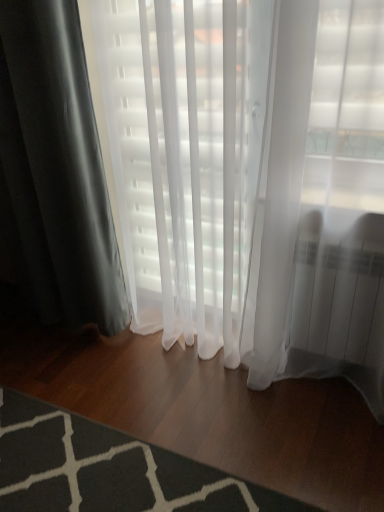
This screenshot has height=512, width=384. I want to click on matte black curtain at left, so click(x=55, y=170).

This screenshot has height=512, width=384. Describe the element at coordinates (55, 170) in the screenshot. I see `matte black curtain at left` at that location.

What is the approximate height of dark gray textured rug at lower left?

1.58 inches.

You are a GUI agent. You are given a task and a screenshot of the screen. Output one action in this format:
    pyautogui.click(x=<x>, y=<y>)
    Task: Click on the dark gray textured rug at lower left
    
    Given the screenshot: What is the action you would take?
    pyautogui.click(x=109, y=469)

This screenshot has width=384, height=512. What do you see at coordinates (109, 469) in the screenshot?
I see `dark gray textured rug at lower left` at bounding box center [109, 469].

The width and height of the screenshot is (384, 512). Find the location of `matte black curtain at left`. matte black curtain at left is located at coordinates (55, 170).

Considering the positions of objects matte black curtain at left and dark gray textured rug at lower left in the image provided, who is more to the right, matte black curtain at left or dark gray textured rug at lower left?

dark gray textured rug at lower left.

Is matte black curtain at left in front of dark gray textured rug at lower left?

No, it is not.

Considering the points (75, 52) and (66, 420), which point is behind, point (75, 52) or point (66, 420)?

The point (66, 420) is behind.

Consider the image. From the image's perspective, is matte black curtain at left under dark gray textured rug at lower left?

No.

From a real-world perspective, is matte black curtain at left below dark gray textured rug at lower left?

No, from a real-world perspective, matte black curtain at left is not beneath dark gray textured rug at lower left.

Can you confirm if matte black curtain at left is wider than dark gray textured rug at lower left?

No.

Considering the sizes of objects matte black curtain at left and dark gray textured rug at lower left in the image provided, who is taller, matte black curtain at left or dark gray textured rug at lower left?

matte black curtain at left.

Consider the image. Is matte black curtain at left smaller than dark gray textured rug at lower left?

Actually, matte black curtain at left might be larger than dark gray textured rug at lower left.

Is matte black curtain at left positioned beyond the bounds of dark gray textured rug at lower left?

Indeed, matte black curtain at left is completely outside dark gray textured rug at lower left.

Is matte black curtain at left beside dark gray textured rug at lower left?

No, matte black curtain at left is not with dark gray textured rug at lower left.

Is matte black curtain at left looking in the opposite direction of dark gray textured rug at lower left?

No, matte black curtain at left's orientation is not away from dark gray textured rug at lower left.

This screenshot has height=512, width=384. Find the location of `curtain above the dark gray textured rug at lower left (from the image's perspective)`. curtain above the dark gray textured rug at lower left (from the image's perspective) is located at coordinates click(x=55, y=170).

Is dark gray textured rug at lower left to the left or to the right of matte black curtain at left in the image?

Clearly, dark gray textured rug at lower left is on the right of matte black curtain at left in the image.

Consider the image. Which is behind, dark gray textured rug at lower left or matte black curtain at left?

matte black curtain at left is further away from the camera.

Which is closer to the camera, (134,510) or (79,60)?

The point (134,510) is more forward.

Looking at this image, from the image's perspective, which is below, dark gray textured rug at lower left or matte black curtain at left?

From the image's view, dark gray textured rug at lower left is below.

From a real-world perspective, does dark gray textured rug at lower left stand above matte black curtain at left?

No, from a real-world perspective, dark gray textured rug at lower left is not on top of matte black curtain at left.

Between dark gray textured rug at lower left and matte black curtain at left, which one has larger width?

dark gray textured rug at lower left is wider.

Does dark gray textured rug at lower left have a greater height compared to matte black curtain at left?

In fact, dark gray textured rug at lower left may be shorter than matte black curtain at left.

Looking at the image, does dark gray textured rug at lower left seem bigger or smaller compared to matte black curtain at left?

Clearly, dark gray textured rug at lower left is smaller in size than matte black curtain at left.

Would you say dark gray textured rug at lower left is outside matte black curtain at left?

That's correct, dark gray textured rug at lower left is outside of matte black curtain at left.

Is dark gray textured rug at lower left positioned far away from matte black curtain at left?

No, dark gray textured rug at lower left is in close proximity to matte black curtain at left.

Is dark gray textured rug at lower left aimed at matte black curtain at left?

No, dark gray textured rug at lower left is not turned towards matte black curtain at left.

How many degrees apart are the facing directions of dark gray textured rug at lower left and matte black curtain at left?

0.42 degrees.

In order to click on curtain located above the dark gray textured rug at lower left (from the image's perspective) in this screenshot , I will do `click(55, 170)`.

Where is `curtain above the dark gray textured rug at lower left (from the image's perspective)`? curtain above the dark gray textured rug at lower left (from the image's perspective) is located at coordinates (55, 170).

Where is `mat below the matte black curtain at left (from the image's perspective)`? This screenshot has height=512, width=384. mat below the matte black curtain at left (from the image's perspective) is located at coordinates (109, 469).